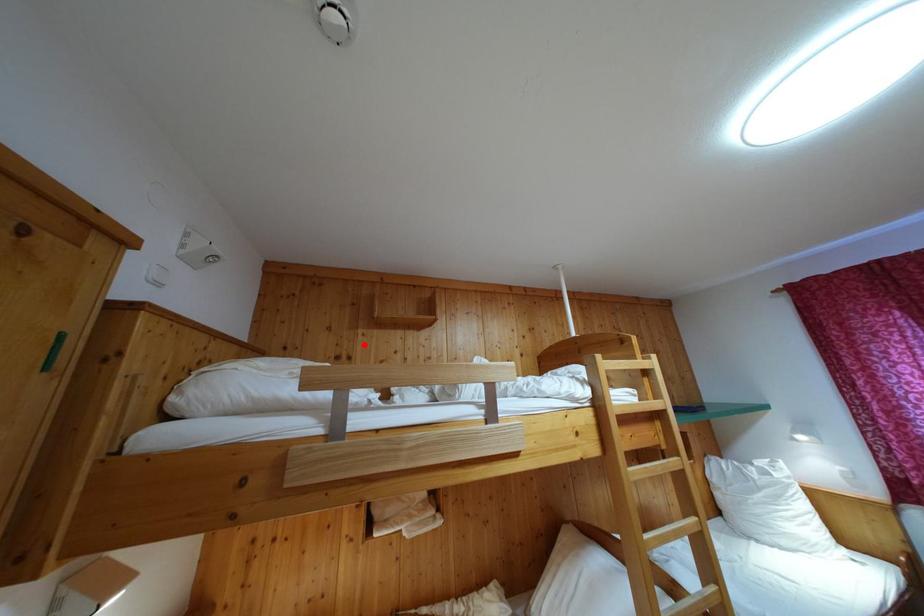
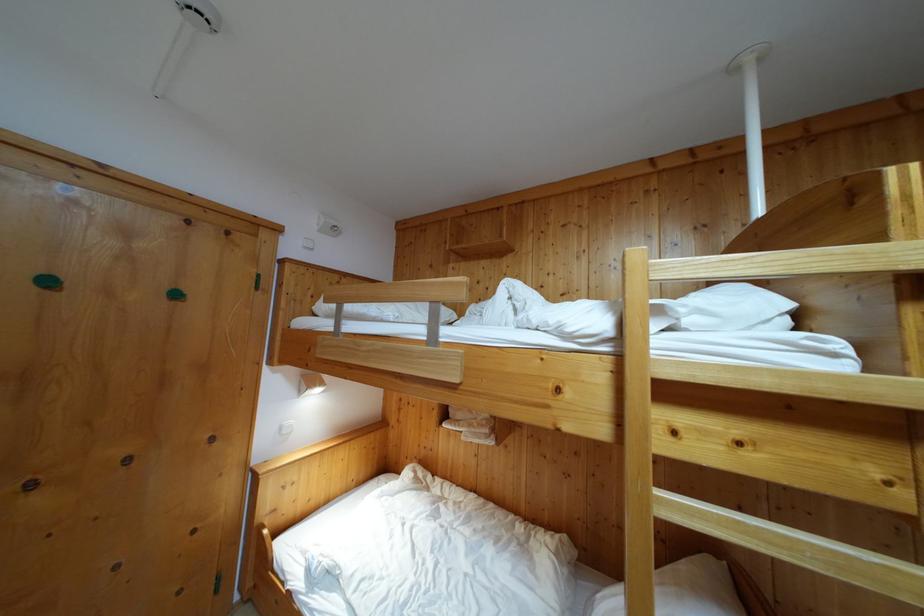
Question: I am providing you with two images of the same scene from different viewpoints. A red point is shown in image1. For the corresponding object point in image2, is it positioned nearer or farther from the camera?

Choices:
 (A) Nearer
 (B) Farther

Answer: (A)